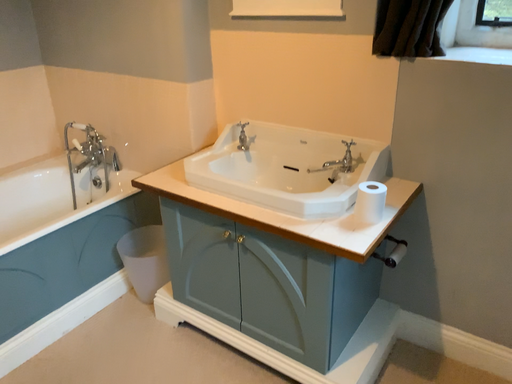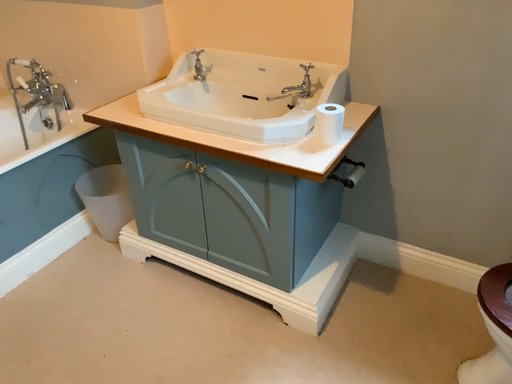
Question: How did the camera likely rotate when shooting the video?

Choices:
 (A) rotated downward
 (B) rotated upward

Answer: (A)